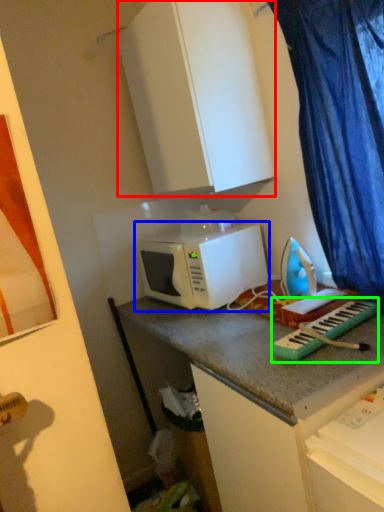
Question: Estimate the real-world distances between objects in this image. Which object is farther from cabinetry (highlighted by a red box), microwave oven (highlighted by a blue box) or musical keyboard (highlighted by a green box)?

Choices:
 (A) microwave oven
 (B) musical keyboard

Answer: (B)